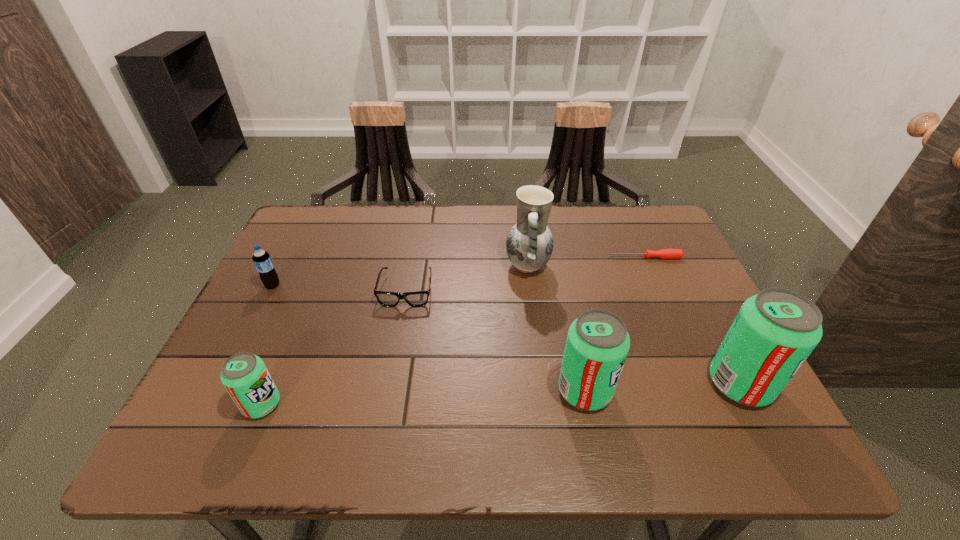
If the aim is uniform spacing by inserting an additional pop_(soda) among them, please point to a vacant space for this new pop_(soda). Please provide its 2D coordinates. Your answer should be formatted as a tuple, i.e. [(x, y)], where the tuple contains the x and y coordinates of a point satisfying the conditions above.

[(425, 397)]